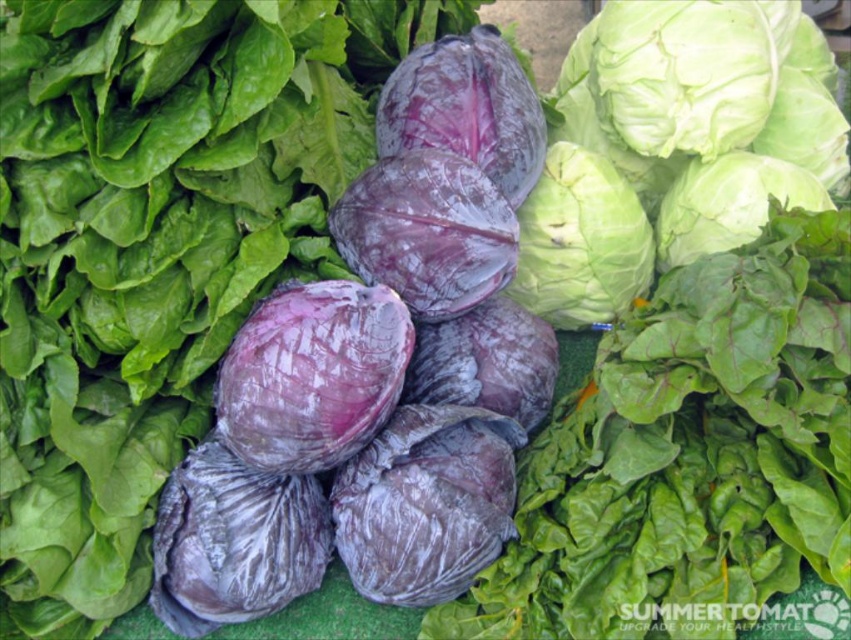
Question: Is purple matte cabbage at center smaller than green crisp at center?

Choices:
 (A) no
 (B) yes

Answer: (B)

Question: Does purple matte cabbage at center have a lesser width compared to green crisp at center?

Choices:
 (A) no
 (B) yes

Answer: (A)

Question: Which point is farther to the camera?

Choices:
 (A) (557, 166)
 (B) (386, 342)

Answer: (A)

Question: Does purple matte cabbage at center have a smaller size compared to green crisp at center?

Choices:
 (A) no
 (B) yes

Answer: (B)